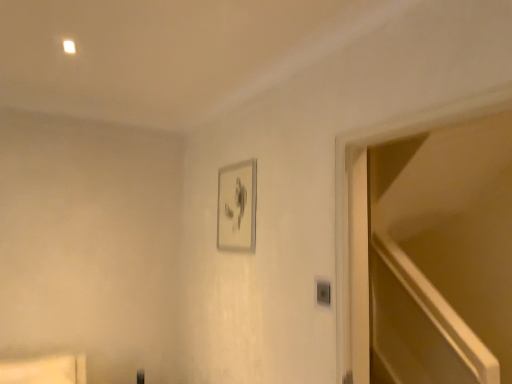
Question: From the image's perspective, is matte wood shelf at lower left located above or below silver metallic picture frame at upper center?

Choices:
 (A) below
 (B) above

Answer: (A)

Question: Is matte wood shelf at lower left inside or outside of silver metallic picture frame at upper center?

Choices:
 (A) inside
 (B) outside

Answer: (B)

Question: Which object is the farthest from the matte wood shelf at lower left?

Choices:
 (A) silver metallic picture frame at upper center
 (B) transparent glass door at right

Answer: (B)

Question: Which of these objects is positioned closest to the silver metallic picture frame at upper center?

Choices:
 (A) transparent glass door at right
 (B) matte wood shelf at lower left

Answer: (B)